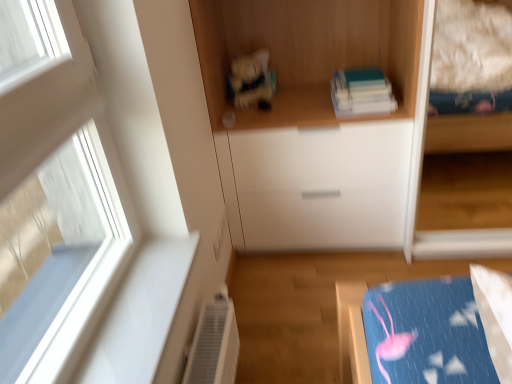
Question: Is matte plastic toy at center taller or shorter than white glossy drawer at center?

Choices:
 (A) tall
 (B) short

Answer: (B)

Question: Does point (266, 71) appear closer or farther from the camera than point (256, 182)?

Choices:
 (A) farther
 (B) closer

Answer: (A)

Question: Which object is the farthest from the wooden books at upper center?

Choices:
 (A) hardcover book at upper center
 (B) white glossy drawer at center
 (C) matte plastic toy at center

Answer: (B)

Question: Estimate the real-world distances between objects in this image. Which object is farther from the wooden books at upper center?

Choices:
 (A) hardcover book at upper center
 (B) white glossy drawer at center
 (C) matte plastic toy at center

Answer: (B)